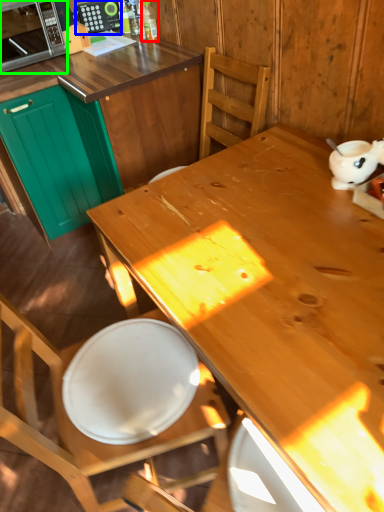
Question: Which object is the closest to the bottle (highlighted by a red box)? Choose among these: appliance (highlighted by a blue box) or microwave oven (highlighted by a green box).

Choices:
 (A) appliance
 (B) microwave oven

Answer: (A)